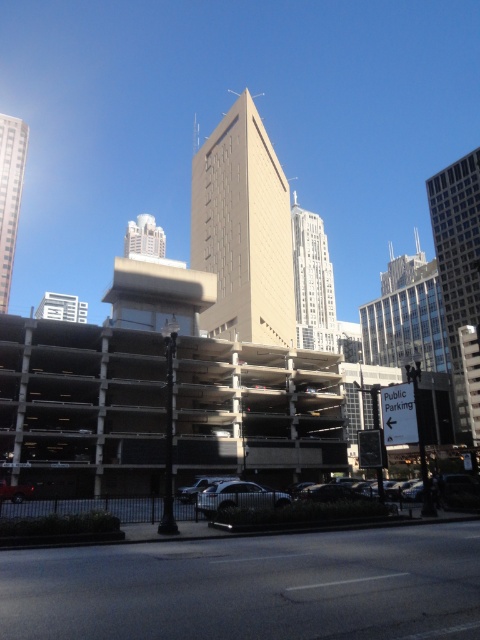
Question: Which point is closer to the camera?

Choices:
 (A) pyautogui.click(x=223, y=225)
 (B) pyautogui.click(x=14, y=227)

Answer: (A)

Question: Can you confirm if beige concrete building at center is positioned below matte glass skyscraper at upper left?

Choices:
 (A) yes
 (B) no

Answer: (A)

Question: Can you confirm if glass skyscraper at right is positioned to the right of shiny silver sedan at center?

Choices:
 (A) yes
 (B) no

Answer: (A)

Question: Which object appears closest to the camera in this image?

Choices:
 (A) shiny silver sedan at center
 (B) gold glass skyscraper at center
 (C) matte glass skyscraper at upper left

Answer: (A)

Question: Which object is closer to the camera taking this photo?

Choices:
 (A) gold glass skyscraper at center
 (B) glass skyscraper at right

Answer: (B)

Question: Does matte glass skyscraper at upper left have a lesser width compared to white glossy building at upper left?

Choices:
 (A) no
 (B) yes

Answer: (B)